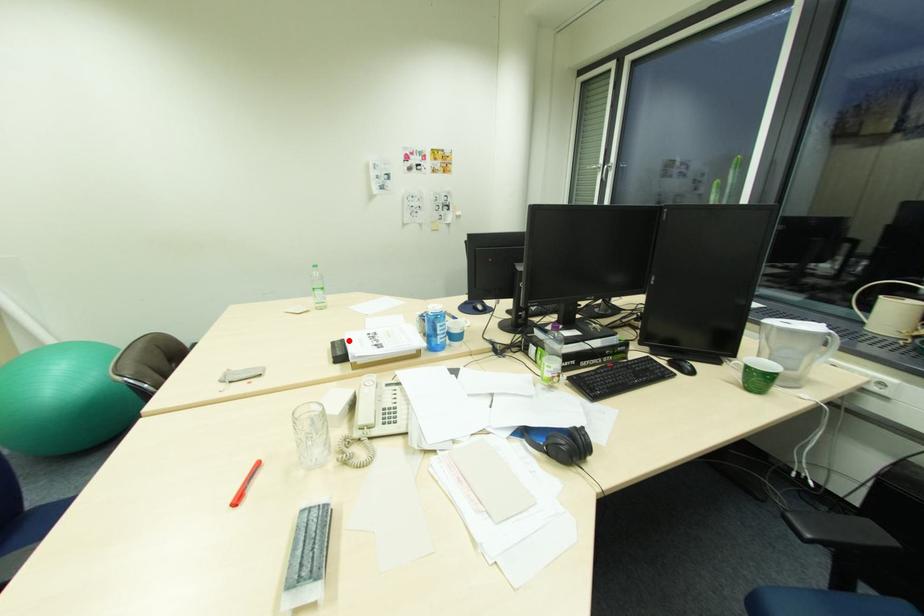
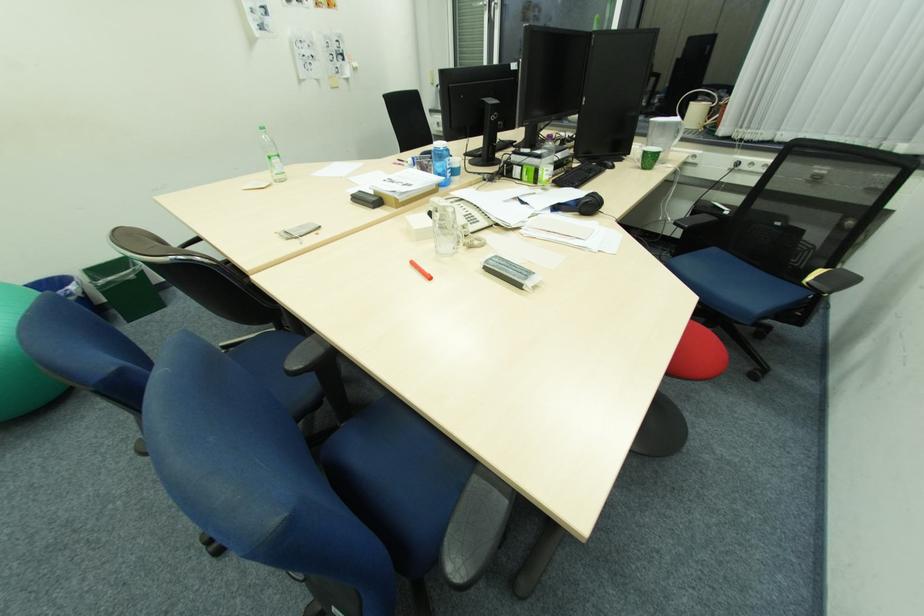
Where in the second image is the point corresponding to the highlighted location from the first image?

(366, 192)